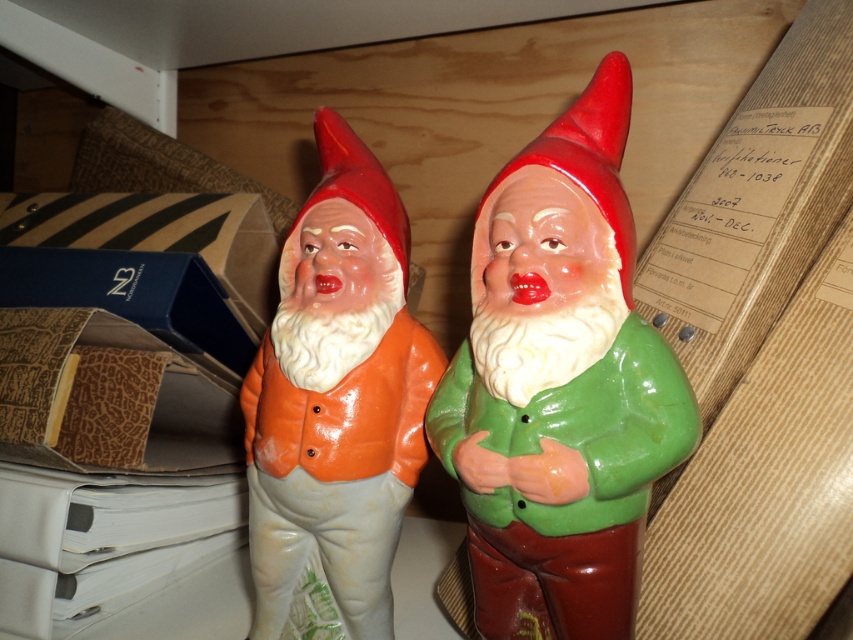
Is point (627, 342) positioned after point (358, 237)?

No, it is in front of (358, 237).

In order to click on green glossy gnome at center in this screenshot , I will do `click(560, 387)`.